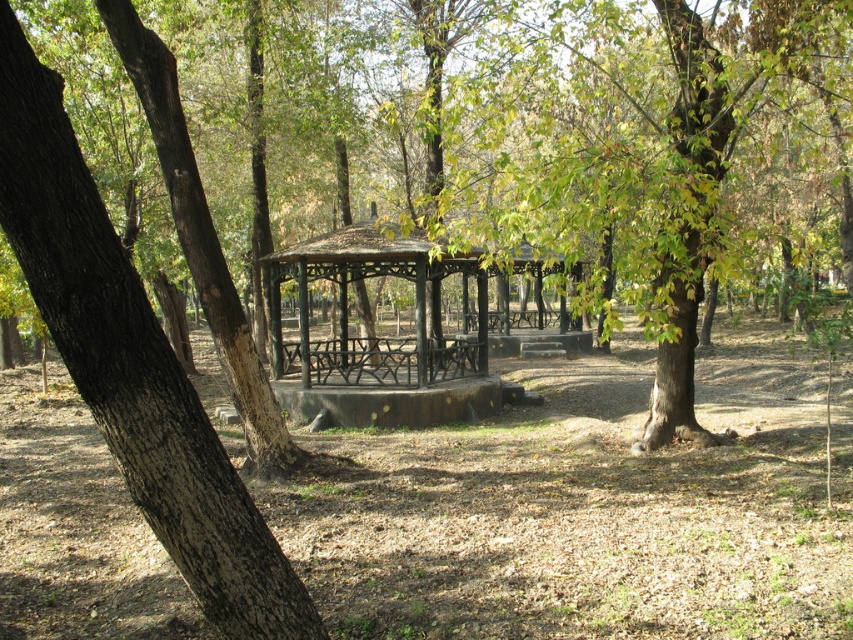
What are the coordinates of the brown wood tree at center?

The brown wood tree at center is located at coordinates point (657, 154).

You are planning to place a large picnic blanket between the brown rough bark tree at left and the rustic wood gazebo at center. Based on their widths, which object should you position closer to the narrower side to ensure the blanket fits properly?

The brown rough bark tree at left has a lesser width compared to rustic wood gazebo at center, so you should position the blanket closer to the brown rough bark tree at left to accommodate the narrower space.

You are a park visitor who wants to take a photo of the brown wood tree at center and the brown rough bark tree at left. Which tree should you stand closer to in order to capture both in a single frame without zooming?

The brown wood tree at center is much taller than the brown rough bark tree at left. To capture both in a single frame without zooming, you should stand closer to the shorter brown rough bark tree at left so that the taller brown wood tree at center appears smaller in the photo, allowing both to fit within the frame.